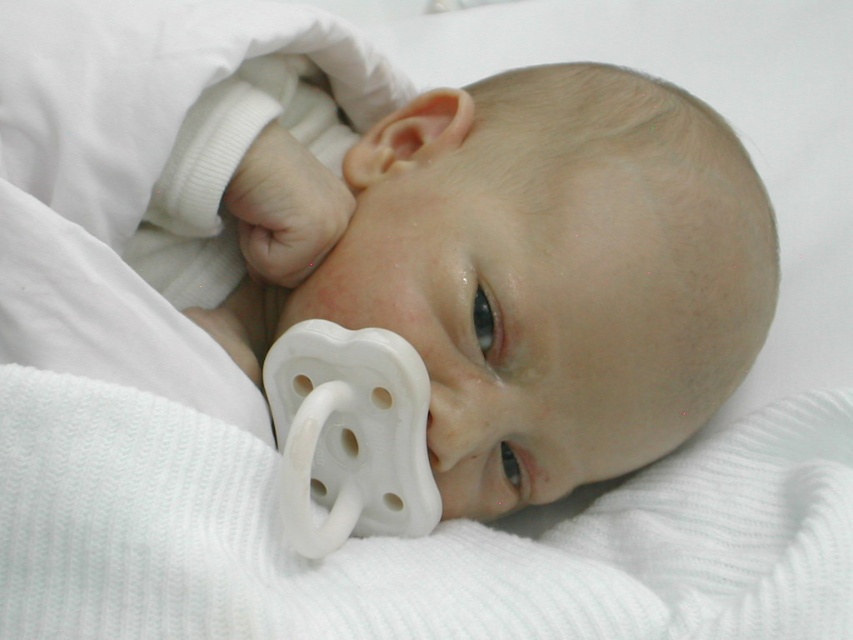
Which is below, white ribbed blanket at center or white rubber pacifier at center?

white ribbed blanket at center is lower down.

Is point (767, 516) positioned in front of point (426, 426)?

No, (767, 516) is behind (426, 426).

Does point (270, 451) come farther from viewer compared to point (432, 428)?

No, (270, 451) is in front of (432, 428).

The height and width of the screenshot is (640, 853). What are the coordinates of `white ribbed blanket at center` in the screenshot? It's located at (405, 540).